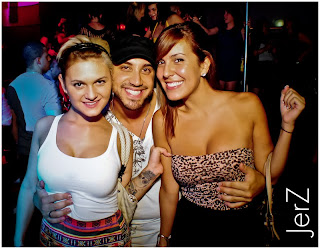
At what (x,y) coordinates should I click in order to perform the action: click on looks like a club venue. Please return your answer as a coordinate pair (x, y). This screenshot has height=249, width=320. Looking at the image, I should click on (60, 13).